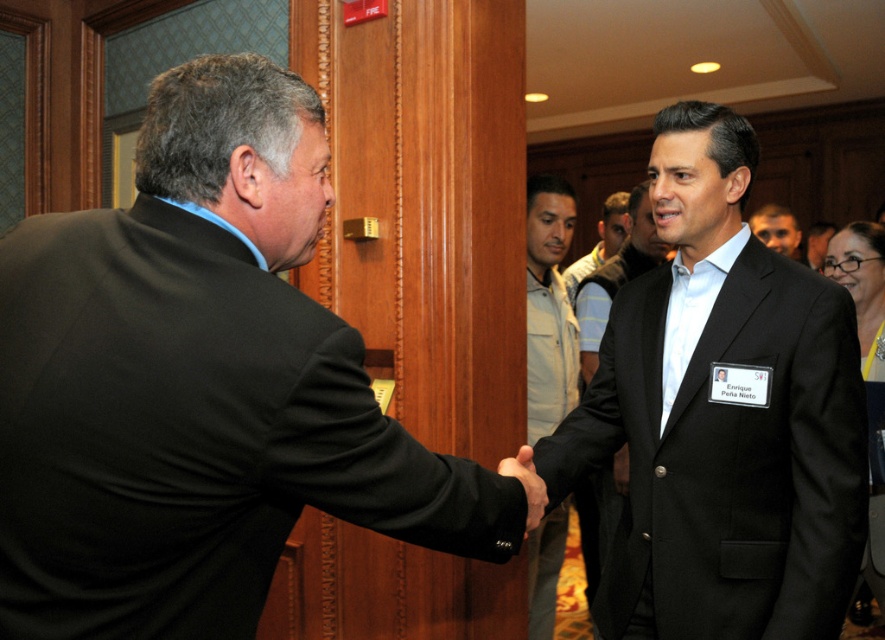
Question: Which point is farther to the camera?

Choices:
 (A) (606, 241)
 (B) (620, 506)
 (C) (783, 244)
 (D) (594, 387)

Answer: (C)

Question: Can you confirm if light brown leather jacket at center is smaller than smooth black suit at center?

Choices:
 (A) yes
 (B) no

Answer: (B)

Question: Is black suit at center bigger than smooth black suit at center?

Choices:
 (A) no
 (B) yes

Answer: (B)

Question: Is black suit at center thinner than smooth black suit at center?

Choices:
 (A) yes
 (B) no

Answer: (A)

Question: Which object appears farthest from the camera in this image?

Choices:
 (A) light beige jacket at center
 (B) smooth black suit at center
 (C) light brown leather jacket at center
 (D) black matte suit at left

Answer: (B)

Question: Among these points, which one is farthest from the camera?

Choices:
 (A) (548, 323)
 (B) (24, 292)
 (C) (596, 492)

Answer: (C)